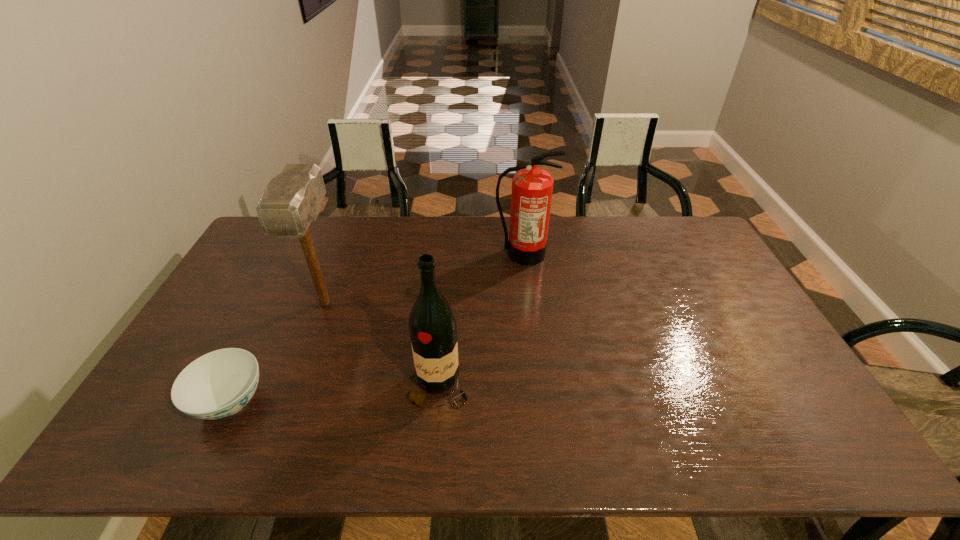
This screenshot has width=960, height=540. Identify the location of free space between the third object from left to right and the second farthest object. (383, 345).

In order to click on free spot between the second farthest object and the third object from left to right in this screenshot , I will do `click(383, 345)`.

The width and height of the screenshot is (960, 540). Find the location of `empty space between the second object from right to left and the leftmost object`. empty space between the second object from right to left and the leftmost object is located at coordinates point(335,394).

The height and width of the screenshot is (540, 960). Find the location of `free spot between the shortest object and the third object from left to right`. free spot between the shortest object and the third object from left to right is located at coordinates (335, 394).

At what (x,y) coordinates should I click in order to perform the action: click on unoccupied area between the wine bottle and the rightmost object. Please return your answer as a coordinate pair (x, y). Looking at the image, I should click on (481, 320).

The width and height of the screenshot is (960, 540). I want to click on the second closest object to the second object from left to right, so click(433, 331).

The height and width of the screenshot is (540, 960). In order to click on object that is the closest one to the farthest object in this screenshot , I will do `click(433, 331)`.